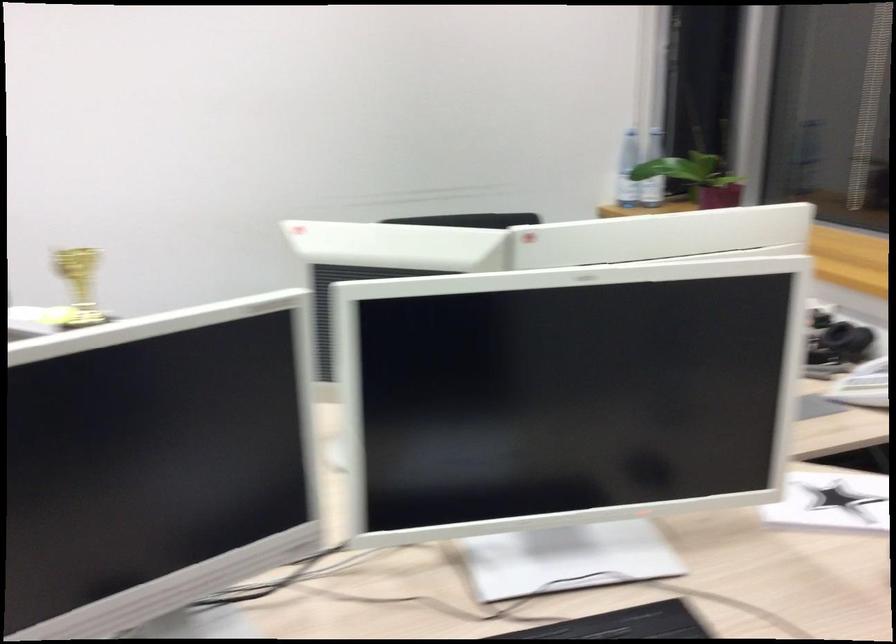
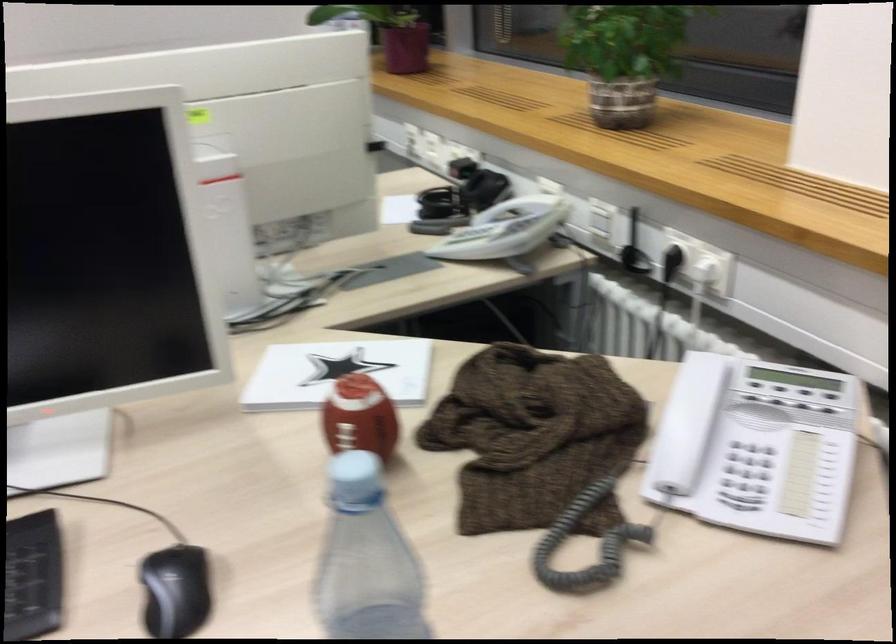
Question: What movement of the cameraman would produce the second image?

Choices:
 (A) Left
 (B) Right
 (C) Forward
 (D) Backward

Answer: (B)